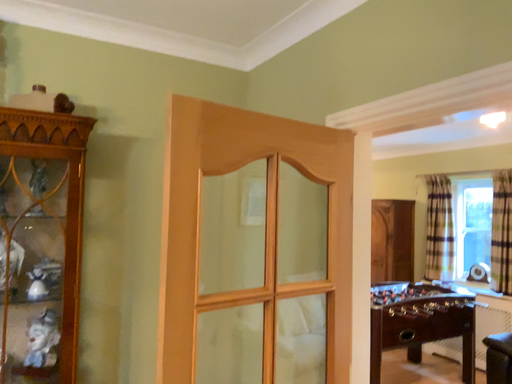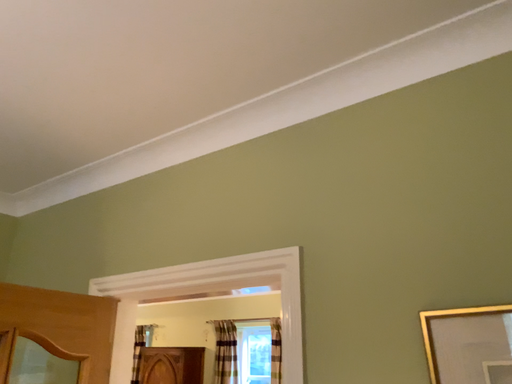
Question: How did the camera likely rotate when shooting the video?

Choices:
 (A) rotated downward
 (B) rotated upward

Answer: (B)